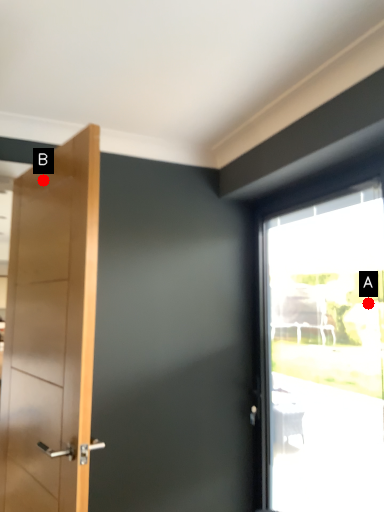
Question: Two points are circled on the image, labeled by A and B beside each circle. Which point is closer to the camera?

Choices:
 (A) A is closer
 (B) B is closer

Answer: (B)